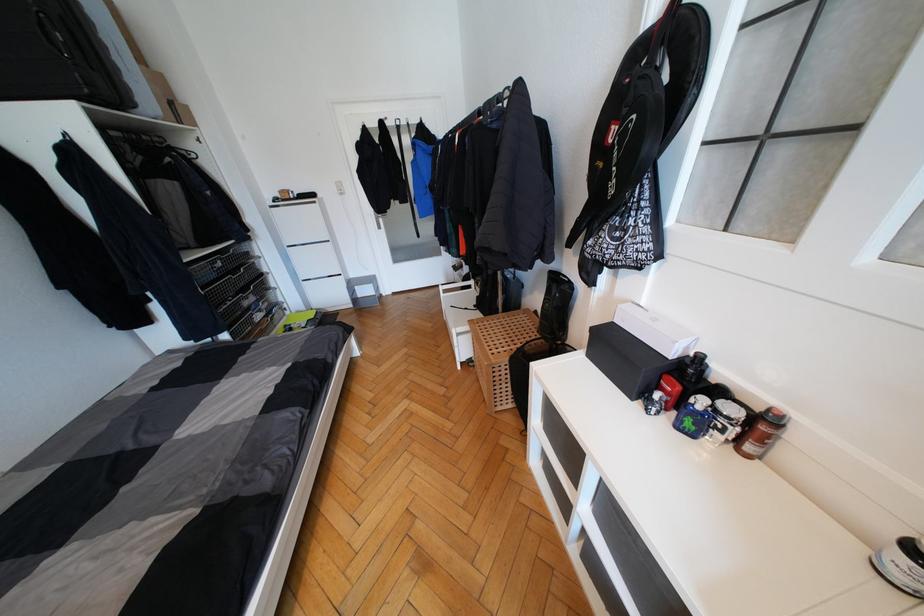
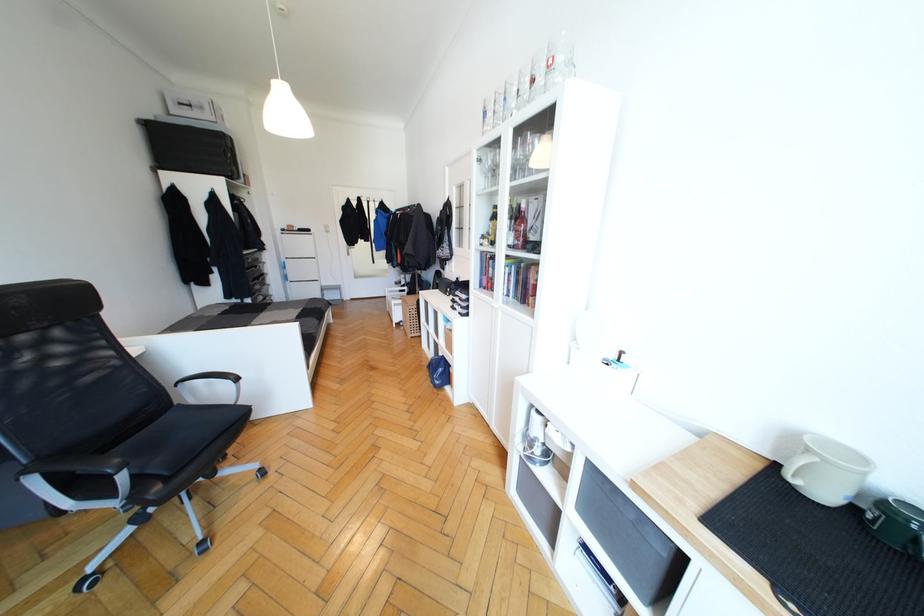
Question: The images are taken continuously from a first-person perspective. In which direction are you moving?

Choices:
 (A) Left
 (B) Right
 (C) Forward
 (D) Backward

Answer: (D)